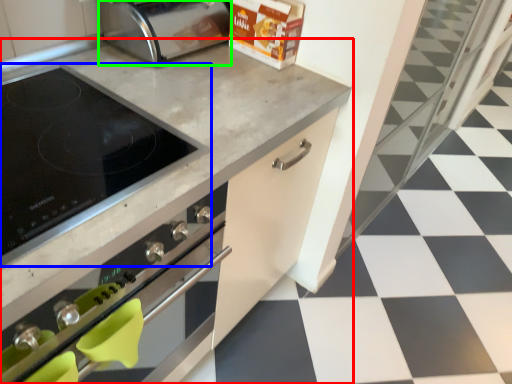
Question: Which object is the farthest from countertop (highlighted by a red box)? Choose among these: kitchen appliance (highlighted by a blue box) or toaster (highlighted by a green box).

Choices:
 (A) kitchen appliance
 (B) toaster

Answer: (B)